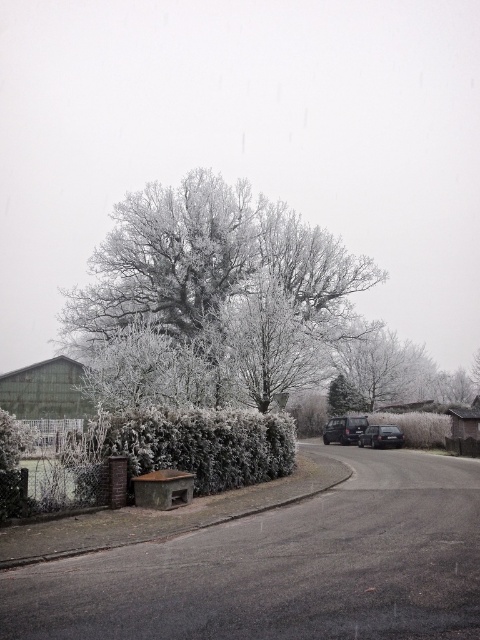
Question: Among these objects, which one is nearest to the camera?

Choices:
 (A) frosted bark tree at center
 (B) green frosted hedge at center
 (C) dark gray metallic car at center

Answer: (A)

Question: Which point is farther to the camera?

Choices:
 (A) white frosty tree at center
 (B) shiny black car at center
 (C) dark gray metallic car at center
 (D) green frosted hedge at center

Answer: (A)

Question: Does frosted bark tree at center appear over shiny black car at center?

Choices:
 (A) no
 (B) yes

Answer: (B)

Question: Among these objects, which one is nearest to the camera?

Choices:
 (A) green frosted hedge at center
 (B) dark gray metallic car at center
 (C) white frosty tree at center

Answer: (A)

Question: Is frosted bark tree at center positioned behind white frosty tree at center?

Choices:
 (A) yes
 (B) no

Answer: (B)

Question: Can you confirm if white frosty tree at center is wider than dark gray metallic car at center?

Choices:
 (A) yes
 (B) no

Answer: (A)